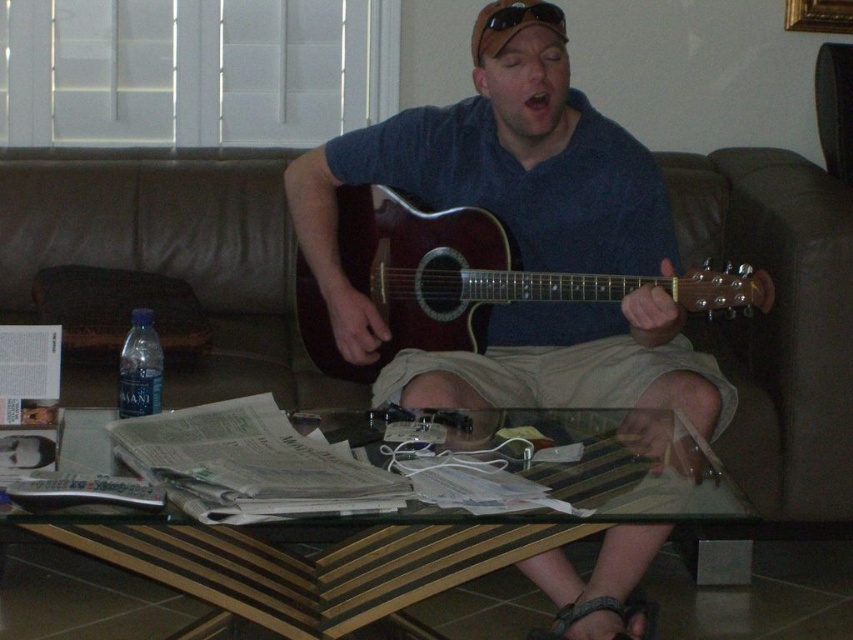
Question: Which object is closer to the camera taking this photo?

Choices:
 (A) transparent glass table at center
 (B) leather at lower center
 (C) blue plastic water bottle at left

Answer: (A)

Question: Where is brown leather couch at center located in relation to blue plastic water bottle at left in the image?

Choices:
 (A) left
 (B) right

Answer: (B)

Question: Based on their relative distances, which object is nearer to the leather at lower center?

Choices:
 (A) blue plastic water bottle at left
 (B) matte brown guitar at center
 (C) shiny brown acoustic guitar at center

Answer: (B)

Question: Which of the following is the closest to the observer?

Choices:
 (A) (32, 298)
 (B) (170, 198)

Answer: (A)

Question: Can you confirm if transparent glass table at center is positioned above clear plastic bottle at lower left?

Choices:
 (A) yes
 (B) no

Answer: (B)

Question: Is brown leather couch at center behind transparent glass table at center?

Choices:
 (A) no
 (B) yes

Answer: (B)